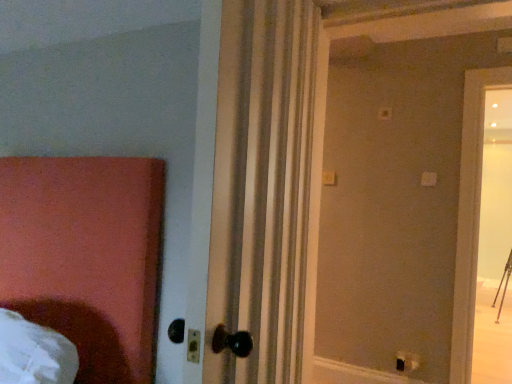
Question: Considering the relative positions of white striped curtain at center and black plastic electric outlet at lower right in the image provided, is white striped curtain at center to the left of black plastic electric outlet at lower right from the viewer's perspective?

Choices:
 (A) no
 (B) yes

Answer: (B)

Question: Considering the relative sizes of white striped curtain at center and black plastic electric outlet at lower right in the image provided, is white striped curtain at center taller than black plastic electric outlet at lower right?

Choices:
 (A) no
 (B) yes

Answer: (B)

Question: From a real-world perspective, is white striped curtain at center positioned over black plastic electric outlet at lower right based on gravity?

Choices:
 (A) yes
 (B) no

Answer: (A)

Question: Is black plastic electric outlet at lower right a part of white striped curtain at center?

Choices:
 (A) no
 (B) yes

Answer: (A)

Question: Is white striped curtain at center outside of black plastic electric outlet at lower right?

Choices:
 (A) yes
 (B) no

Answer: (A)

Question: Is white striped curtain at center looking in the opposite direction of black plastic electric outlet at lower right?

Choices:
 (A) no
 (B) yes

Answer: (A)

Question: From the image's perspective, is black plastic electric outlet at lower right located above white striped curtain at center?

Choices:
 (A) yes
 (B) no

Answer: (B)

Question: Is black plastic electric outlet at lower right to the right of white striped curtain at center from the viewer's perspective?

Choices:
 (A) no
 (B) yes

Answer: (B)

Question: Is black plastic electric outlet at lower right positioned beyond the bounds of white striped curtain at center?

Choices:
 (A) yes
 (B) no

Answer: (A)

Question: Does black plastic electric outlet at lower right come behind white striped curtain at center?

Choices:
 (A) no
 (B) yes

Answer: (B)

Question: Is black plastic electric outlet at lower right not near white striped curtain at center?

Choices:
 (A) yes
 (B) no

Answer: (A)

Question: From a real-world perspective, does black plastic electric outlet at lower right stand above white striped curtain at center?

Choices:
 (A) no
 (B) yes

Answer: (A)

Question: Based on their positions, is white striped curtain at center located to the left or right of black plastic electric outlet at lower right?

Choices:
 (A) left
 (B) right

Answer: (A)